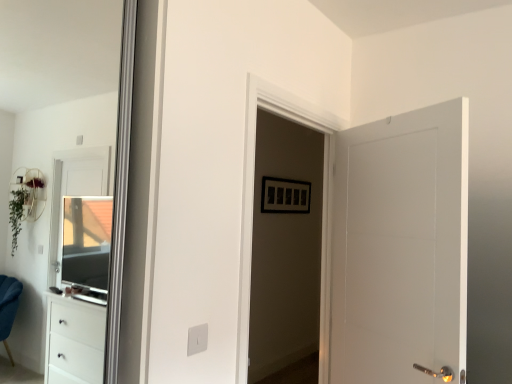
The height and width of the screenshot is (384, 512). What do you see at coordinates (286, 245) in the screenshot? I see `white glossy door at center` at bounding box center [286, 245].

In the scene shown: What is the approximate height of clear glass window at left?

It is 5.08 feet.

Locate an element on the screen. white glossy door at center is located at coordinates (286, 245).

Is clear glass window at left wider or thinner than white matte door at right?

In the image, clear glass window at left appears to be more narrow than white matte door at right.

From the image's perspective, relative to white matte door at right, is clear glass window at left above or below?

Clearly, from the image's perspective, clear glass window at left is below white matte door at right.

Considering the positions of objects clear glass window at left and white matte door at right in the image provided, who is more to the right, clear glass window at left or white matte door at right?

white matte door at right is more to the right.

Which object is further away from the camera taking this photo, clear glass window at left or white matte door at right?

Positioned behind is clear glass window at left.

Can you confirm if white matte door at right is wider than clear glass window at left?

Indeed, white matte door at right has a greater width compared to clear glass window at left.

Considering the positions of objects white matte door at right and clear glass window at left in the image provided, who is more to the right, white matte door at right or clear glass window at left?

white matte door at right is more to the right.

At what (x,y) coordinates should I click in order to perform the action: click on window lying behind the white matte door at right. Please return your answer as a coordinate pair (x, y). Image resolution: width=512 pixels, height=384 pixels. Looking at the image, I should click on (74, 191).

From the picture: Can you confirm if white matte door at right is bigger than clear glass window at left?

Correct, white matte door at right is larger in size than clear glass window at left.

From the image's perspective, is white glossy door at center above or below white matte door at right?

From the image's perspective, white glossy door at center appears above white matte door at right.

Between white glossy door at center and white matte door at right, which one is positioned in front?

white matte door at right is closer to the camera.

From a real-world perspective, between white glossy door at center and white matte door at right, who is vertically lower?

From a 3D spatial view, white matte door at right is below.

In the scene shown: Is white glossy door at center aimed at white matte door at right?

Yes, white glossy door at center faces towards white matte door at right.

Can you confirm if white matte door at right is shorter than white glossy door at center?

Indeed, white matte door at right has a lesser height compared to white glossy door at center.

Is white matte door at right not close to white glossy door at center?

white matte door at right is positioned a significant distance from white glossy door at center.

Is white matte door at right wider than white glossy door at center?

Indeed, white matte door at right has a greater width compared to white glossy door at center.

From the image's perspective, which one is positioned lower, white matte door at right or white glossy door at center?

white matte door at right appears lower in the image.

Does clear glass window at left lie behind white glossy door at center?

Yes.

Is clear glass window at left touching white glossy door at center?

No, clear glass window at left is not next to white glossy door at center.

You are a GUI agent. You are given a task and a screenshot of the screen. Output one action in this format:
    pyautogui.click(x=<x>, y=<y>)
    Task: Click on the window below the white glossy door at center (from a real-world perspective)
    This screenshot has height=384, width=512.
    Given the screenshot: What is the action you would take?
    pyautogui.click(x=74, y=191)

Is clear glass window at left a part of white glossy door at center?

Definitely not — clear glass window at left is not inside white glossy door at center.

Is white glossy door at center looking in the opposite direction of clear glass window at left?

Correct, white glossy door at center is looking away from clear glass window at left.

From a real-world perspective, who is located lower, white glossy door at center or clear glass window at left?

In real-world perspective, clear glass window at left is lower.

From the image's perspective, between white glossy door at center and clear glass window at left, which one is located above?

white glossy door at center is shown above in the image.

The height and width of the screenshot is (384, 512). What are the coordinates of `door that is above the clear glass window at left (from a real-world perspective)` in the screenshot? It's located at [x=400, y=248].

The width and height of the screenshot is (512, 384). What are the coordinates of `door lying on the right of clear glass window at left` in the screenshot? It's located at coord(400,248).

Estimate the real-world distances between objects in this image. Which object is closer to white glossy door at center, white matte door at right or clear glass window at left?

Among the two, clear glass window at left is located nearer to white glossy door at center.

When comparing their distances from clear glass window at left, does white matte door at right or white glossy door at center seem further?

The object further to clear glass window at left is white matte door at right.

From the image, which object appears to be nearer to white matte door at right, white glossy door at center or clear glass window at left?

Among the two, white glossy door at center is located nearer to white matte door at right.

Estimate the real-world distances between objects in this image. Which object is further from white glossy door at center, clear glass window at left or white matte door at right?

white matte door at right.

Estimate the real-world distances between objects in this image. Which object is further from clear glass window at left, white glossy door at center or white matte door at right?

white matte door at right lies further to clear glass window at left than the other object.

Estimate the real-world distances between objects in this image. Which object is closer to white matte door at right, clear glass window at left or white glossy door at center?

white glossy door at center is positioned closer to the anchor white matte door at right.

At what (x,y) coordinates should I click in order to perform the action: click on screen door between clear glass window at left and white matte door at right. Please return your answer as a coordinate pair (x, y). The width and height of the screenshot is (512, 384). Looking at the image, I should click on (286, 245).